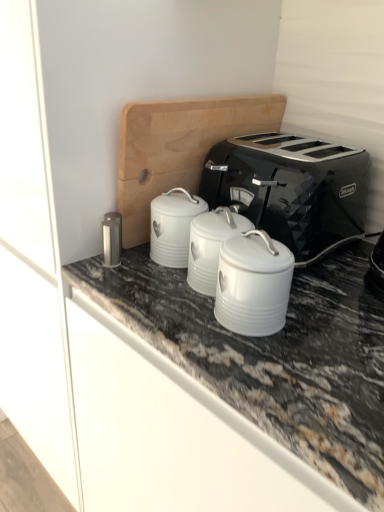
What is the approximate height of satin silver canister at center-left, marked as the third appliance in a right-to-left arrangement?

It is 3.37 inches.

Describe the element at coordinates (112, 239) in the screenshot. I see `satin silver canister at center-left, which ranks as the first appliance in left-to-right order` at that location.

The height and width of the screenshot is (512, 384). What do you see at coordinates (253, 284) in the screenshot? I see `white ceramic canister at center, the third appliance in the left-to-right sequence` at bounding box center [253, 284].

Locate an element on the screen. This screenshot has width=384, height=512. satin silver canister at center-left, marked as the third appliance in a right-to-left arrangement is located at coordinates (112, 239).

Is there a large distance between white enameled canister at center, the 2th appliance when ordered from right to left, and satin silver canister at center-left, marked as the third appliance in a right-to-left arrangement?

white enameled canister at center, the 2th appliance when ordered from right to left, is near satin silver canister at center-left, marked as the third appliance in a right-to-left arrangement, not far away.

From the image's perspective, between white enameled canister at center, which appears as the 2th appliance when viewed from the left, and satin silver canister at center-left, which ranks as the first appliance in left-to-right order, who is located below?

white enameled canister at center, which appears as the 2th appliance when viewed from the left.

Does point (189, 246) come farther from viewer compared to point (114, 257)?

No, it is not.

Consider the image. Is white enameled canister at center, which appears as the 2th appliance when viewed from the left, positioned with its back to satin silver canister at center-left, marked as the third appliance in a right-to-left arrangement?

No, white enameled canister at center, which appears as the 2th appliance when viewed from the left,'s orientation is not away from satin silver canister at center-left, marked as the third appliance in a right-to-left arrangement.

Looking at this image, from a real-world perspective, who is located lower, white enameled canister at center, which appears as the 2th appliance when viewed from the left, or black metallic toaster at center?

From a 3D spatial view, white enameled canister at center, which appears as the 2th appliance when viewed from the left, is below.

Is white enameled canister at center, which appears as the 2th appliance when viewed from the left, positioned beyond the bounds of black metallic toaster at center?

white enameled canister at center, which appears as the 2th appliance when viewed from the left, lies outside black metallic toaster at center's area.

In the scene shown: Considering the positions of objects white enameled canister at center, which appears as the 2th appliance when viewed from the left, and black metallic toaster at center in the image provided, who is more to the left, white enameled canister at center, which appears as the 2th appliance when viewed from the left, or black metallic toaster at center?

white enameled canister at center, which appears as the 2th appliance when viewed from the left, is more to the left.

Considering the sizes of objects white ceramic canister at center, the first appliance viewed from the right, and white enameled canister at center, which appears as the 2th appliance when viewed from the left, in the image provided, who is thinner, white ceramic canister at center, the first appliance viewed from the right, or white enameled canister at center, which appears as the 2th appliance when viewed from the left,?

Thinner between the two is white ceramic canister at center, the first appliance viewed from the right.

Consider the image. Which of these two, white ceramic canister at center, the first appliance viewed from the right, or white enameled canister at center, which appears as the 2th appliance when viewed from the left, stands shorter?

white enameled canister at center, which appears as the 2th appliance when viewed from the left, is shorter.

Where is `the 1st appliance behind the white ceramic canister at center, the third appliance in the left-to-right sequence, starting your count from the anchor`? the 1st appliance behind the white ceramic canister at center, the third appliance in the left-to-right sequence, starting your count from the anchor is located at coordinates (211, 245).

Is white ceramic canister at center, the third appliance in the left-to-right sequence, to the left or to the right of white enameled canister at center, which appears as the 2th appliance when viewed from the left, in the image?

From the image, it's evident that white ceramic canister at center, the third appliance in the left-to-right sequence, is to the right of white enameled canister at center, which appears as the 2th appliance when viewed from the left.

Is white enameled canister at center, which appears as the 2th appliance when viewed from the left, located within satin silver canister at center-left, which ranks as the first appliance in left-to-right order?

No, white enameled canister at center, which appears as the 2th appliance when viewed from the left, is located outside of satin silver canister at center-left, which ranks as the first appliance in left-to-right order.

Could you measure the distance between satin silver canister at center-left, marked as the third appliance in a right-to-left arrangement, and white enameled canister at center, the 2th appliance when ordered from right to left?

The distance of satin silver canister at center-left, marked as the third appliance in a right-to-left arrangement, from white enameled canister at center, the 2th appliance when ordered from right to left, is 7.07 inches.

Consider the image. Considering the relative positions of satin silver canister at center-left, which ranks as the first appliance in left-to-right order, and white enameled canister at center, the 2th appliance when ordered from right to left, in the image provided, is satin silver canister at center-left, which ranks as the first appliance in left-to-right order, to the left of white enameled canister at center, the 2th appliance when ordered from right to left, from the viewer's perspective?

Indeed, satin silver canister at center-left, which ranks as the first appliance in left-to-right order, is positioned on the left side of white enameled canister at center, the 2th appliance when ordered from right to left.

Considering the sizes of satin silver canister at center-left, marked as the third appliance in a right-to-left arrangement, and white enameled canister at center, the 2th appliance when ordered from right to left, in the image, is satin silver canister at center-left, marked as the third appliance in a right-to-left arrangement, bigger or smaller than white enameled canister at center, the 2th appliance when ordered from right to left,?

satin silver canister at center-left, marked as the third appliance in a right-to-left arrangement, is smaller than white enameled canister at center, the 2th appliance when ordered from right to left.

Does black metallic toaster at center turn towards white enameled canister at center, the 2th appliance when ordered from right to left?

Yes, black metallic toaster at center is turned towards white enameled canister at center, the 2th appliance when ordered from right to left.

From a real-world perspective, which is physically below, black metallic toaster at center or white enameled canister at center, which appears as the 2th appliance when viewed from the left?

From a 3D spatial view, white enameled canister at center, which appears as the 2th appliance when viewed from the left, is below.

From the image's perspective, which one is positioned higher, black metallic toaster at center or white enameled canister at center, the 2th appliance when ordered from right to left?

black metallic toaster at center, from the image's perspective.

Measure the distance from black metallic toaster at center to white enameled canister at center, the 2th appliance when ordered from right to left.

black metallic toaster at center and white enameled canister at center, the 2th appliance when ordered from right to left, are 20.15 centimeters apart.

Measure the distance from satin silver canister at center-left, marked as the third appliance in a right-to-left arrangement, to black metallic toaster at center.

satin silver canister at center-left, marked as the third appliance in a right-to-left arrangement, and black metallic toaster at center are 13.59 inches apart.

Can you confirm if satin silver canister at center-left, which ranks as the first appliance in left-to-right order, is bigger than black metallic toaster at center?

No.

Between satin silver canister at center-left, marked as the third appliance in a right-to-left arrangement, and black metallic toaster at center, which one appears on the right side from the viewer's perspective?

From the viewer's perspective, black metallic toaster at center appears more on the right side.

From a real-world perspective, is satin silver canister at center-left, marked as the third appliance in a right-to-left arrangement, physically located above or below black metallic toaster at center?

Clearly, from a real-world perspective, satin silver canister at center-left, marked as the third appliance in a right-to-left arrangement, is below black metallic toaster at center.

Is white ceramic canister at center, the first appliance viewed from the right, located outside satin silver canister at center-left, marked as the third appliance in a right-to-left arrangement?

Absolutely, white ceramic canister at center, the first appliance viewed from the right, is external to satin silver canister at center-left, marked as the third appliance in a right-to-left arrangement.

Which object is positioned more to the right, white ceramic canister at center, the first appliance viewed from the right, or satin silver canister at center-left, marked as the third appliance in a right-to-left arrangement?

Positioned to the right is white ceramic canister at center, the first appliance viewed from the right.

Is white ceramic canister at center, the first appliance viewed from the right, positioned before satin silver canister at center-left, marked as the third appliance in a right-to-left arrangement?

That is True.

Who is shorter, white ceramic canister at center, the third appliance in the left-to-right sequence, or satin silver canister at center-left, marked as the third appliance in a right-to-left arrangement?

satin silver canister at center-left, marked as the third appliance in a right-to-left arrangement, is shorter.

There is a satin silver canister at center-left, which ranks as the first appliance in left-to-right order. Identify the location of the 2nd appliance above it (from a real-world perspective). The height and width of the screenshot is (512, 384). (211, 245).

From the black metallic toaster at center, count the 2nd appliance to the left and point to it. Please provide its 2D coordinates.

[(211, 245)]

When comparing their distances from satin silver canister at center-left, which ranks as the first appliance in left-to-right order, does white enameled canister at center, the 2th appliance when ordered from right to left, or black metallic toaster at center seem further?

Based on the image, black metallic toaster at center appears to be further to satin silver canister at center-left, which ranks as the first appliance in left-to-right order.

When comparing their distances from white enameled canister at center, which appears as the 2th appliance when viewed from the left, does satin silver canister at center-left, marked as the third appliance in a right-to-left arrangement, or black metallic toaster at center seem closer?

Among the two, satin silver canister at center-left, marked as the third appliance in a right-to-left arrangement, is located nearer to white enameled canister at center, which appears as the 2th appliance when viewed from the left.

Which object lies further to the anchor point black metallic toaster at center, white enameled canister at center, the 2th appliance when ordered from right to left, or satin silver canister at center-left, which ranks as the first appliance in left-to-right order?

satin silver canister at center-left, which ranks as the first appliance in left-to-right order, is positioned further to the anchor black metallic toaster at center.

Looking at the image, which one is located closer to white enameled canister at center, the 2th appliance when ordered from right to left, black metallic toaster at center or white ceramic canister at center, the first appliance viewed from the right?

Among the two, white ceramic canister at center, the first appliance viewed from the right, is located nearer to white enameled canister at center, the 2th appliance when ordered from right to left.

Based on their spatial positions, is white ceramic canister at center, the first appliance viewed from the right, or black metallic toaster at center further from white enameled canister at center, the 2th appliance when ordered from right to left?

black metallic toaster at center.

From the image, which object appears to be nearer to white ceramic canister at center, the third appliance in the left-to-right sequence, satin silver canister at center-left, which ranks as the first appliance in left-to-right order, or white enameled canister at center, which appears as the 2th appliance when viewed from the left?

The object closer to white ceramic canister at center, the third appliance in the left-to-right sequence, is white enameled canister at center, which appears as the 2th appliance when viewed from the left.

Based on their spatial positions, is satin silver canister at center-left, which ranks as the first appliance in left-to-right order, or white ceramic canister at center, the third appliance in the left-to-right sequence, closer to white enameled canister at center, which appears as the 2th appliance when viewed from the left?

white ceramic canister at center, the third appliance in the left-to-right sequence.

Considering their positions, is black metallic toaster at center positioned closer to satin silver canister at center-left, marked as the third appliance in a right-to-left arrangement, than white ceramic canister at center, the first appliance viewed from the right?

white ceramic canister at center, the first appliance viewed from the right, is positioned closer to the anchor satin silver canister at center-left, marked as the third appliance in a right-to-left arrangement.

This screenshot has width=384, height=512. I want to click on appliance between satin silver canister at center-left, which ranks as the first appliance in left-to-right order, and white ceramic canister at center, the third appliance in the left-to-right sequence, in the horizontal direction, so click(x=211, y=245).